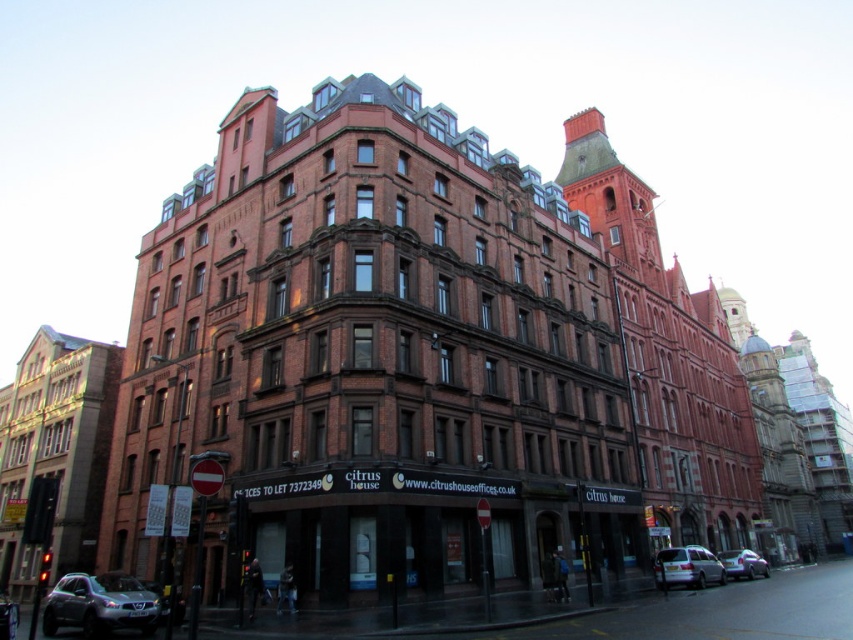
Who is shorter, silver metallic car at lower left or silver metallic van at lower right?

Standing shorter between the two is silver metallic van at lower right.

Between point (44, 627) and point (665, 579), which one is positioned in front?

Point (44, 627)

Locate an element on the screen. The image size is (853, 640). silver metallic car at lower left is located at coordinates (99, 604).

What do you see at coordinates (422, 356) in the screenshot? I see `brick building at center` at bounding box center [422, 356].

Does point (296, 371) lie behind point (13, 624)?

That is True.

The image size is (853, 640). I want to click on brick building at center, so click(422, 356).

Which is behind, point (494, 464) or point (722, 564)?

The point (722, 564) is more distant.

Between brick building at center and metallic silver car at lower right, which one appears on the right side from the viewer's perspective?

From the viewer's perspective, metallic silver car at lower right appears more on the right side.

Is point (648, 202) in front of point (730, 573)?

No, (648, 202) is further to viewer.

You are a GUI agent. You are given a task and a screenshot of the screen. Output one action in this format:
    pyautogui.click(x=<x>, y=<y>)
    Task: Click on the brick building at center
    Image resolution: width=853 pixels, height=640 pixels.
    Given the screenshot: What is the action you would take?
    pyautogui.click(x=422, y=356)